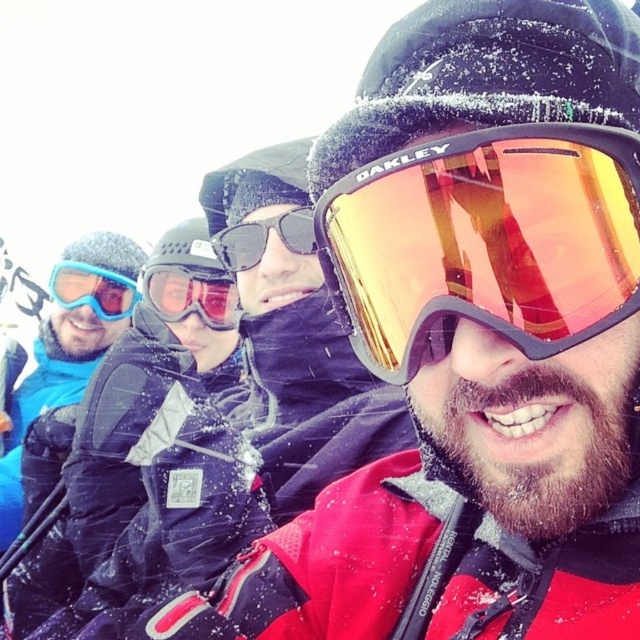
Can you confirm if gold reflective oakley goggles at center is positioned above matte black jacket at center?

Yes, gold reflective oakley goggles at center is above matte black jacket at center.

Can you confirm if gold reflective oakley goggles at center is thinner than matte black jacket at center?

Correct, gold reflective oakley goggles at center's width is less than matte black jacket at center's.

Who is more forward, (x=596, y=132) or (x=276, y=449)?

Point (x=596, y=132) is in front.

Find the location of a particular element. The width and height of the screenshot is (640, 640). gold reflective oakley goggles at center is located at coordinates (484, 241).

Is gold reflective oakley goggles at center in front of matte blue goggles at left?

Yes.

Does gold reflective oakley goggles at center have a smaller size compared to matte blue goggles at left?

Correct, gold reflective oakley goggles at center occupies less space than matte blue goggles at left.

Which is behind, point (419, 177) or point (60, 275)?

The point (60, 275) is behind.

In order to click on gold reflective oakley goggles at center in this screenshot , I will do `click(484, 241)`.

Is matte black sunglasses at center bigger than matte blue goggles at left?

Actually, matte black sunglasses at center might be smaller than matte blue goggles at left.

Does matte black sunglasses at center appear on the left side of matte blue goggles at left?

In fact, matte black sunglasses at center is to the right of matte blue goggles at left.

At what (x,y) coordinates should I click in order to perform the action: click on matte black sunglasses at center. Please return your answer as a coordinate pair (x, y). Image resolution: width=640 pixels, height=640 pixels. Looking at the image, I should click on (262, 237).